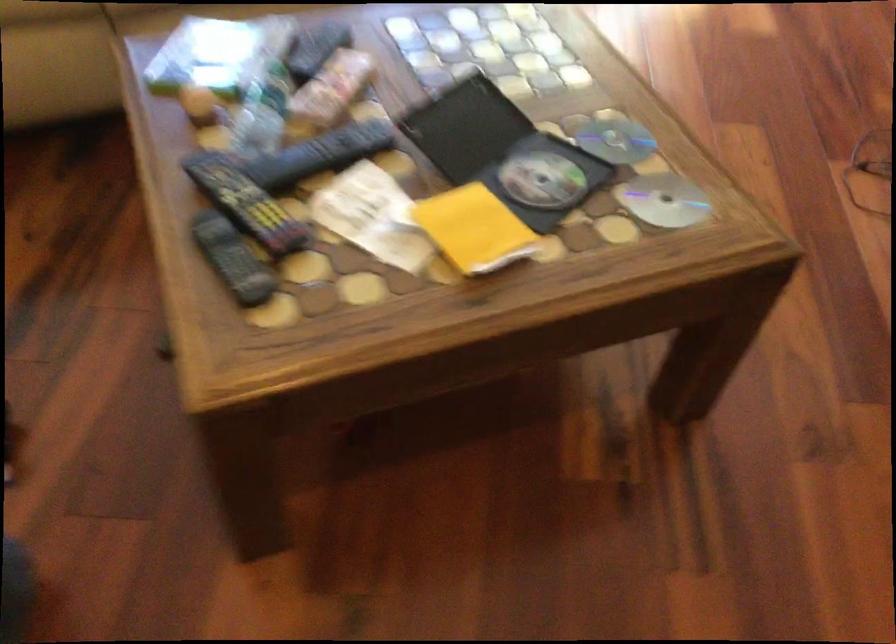
Find the location of a particular element. This screenshot has width=896, height=644. yellow padded envelope is located at coordinates (474, 229).